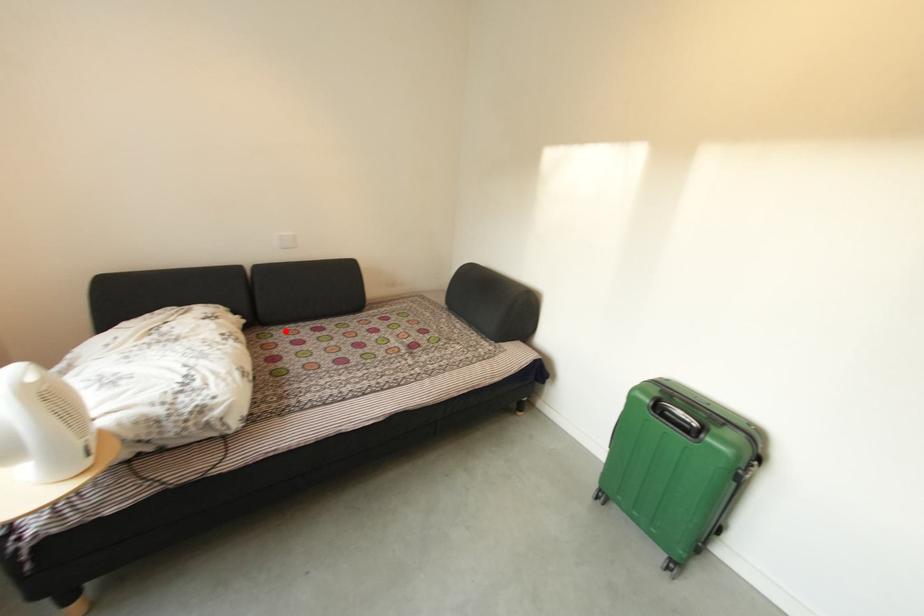
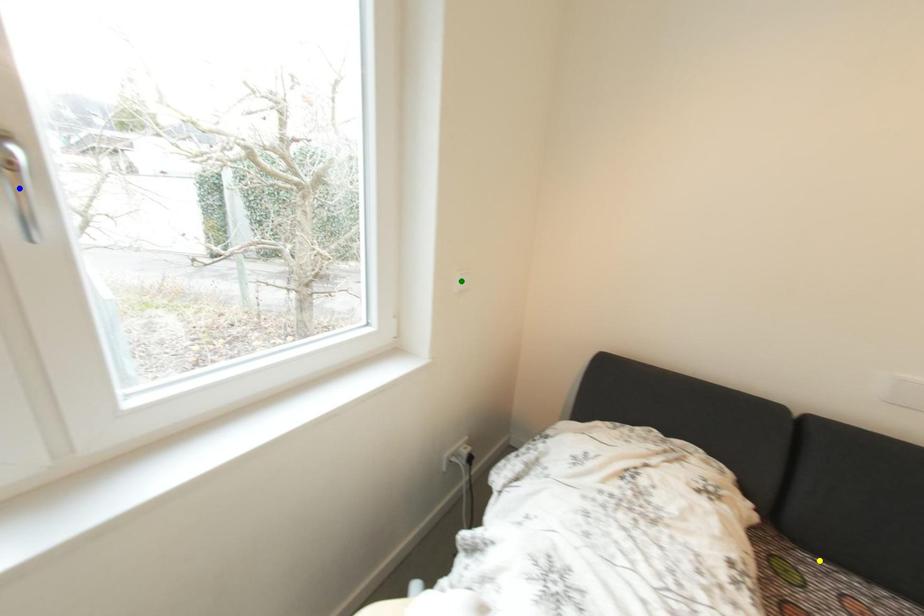
Question: I am providing you with two images of the same scene from different viewpoints. A red point is marked on the first image. You are given multiple points on the second image. Can you choose the point in image 2 that corresponds to the point in image 1?

Choices:
 (A) yellow point
 (B) green point
 (C) blue point

Answer: (A)